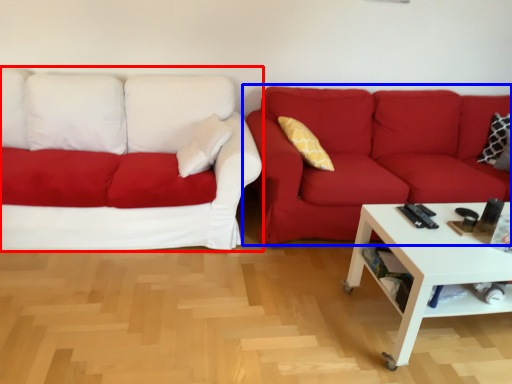
Question: Which object is closer to the camera taking this photo, studio couch (highlighted by a red box) or studio couch (highlighted by a blue box)?

Choices:
 (A) studio couch
 (B) studio couch

Answer: (A)